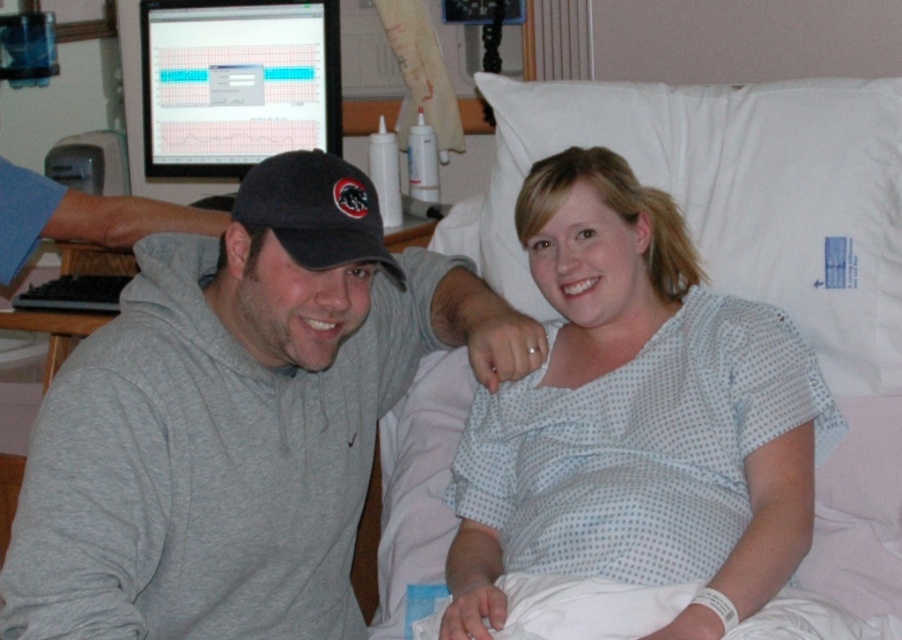
Based on the coordinates provided, which object is located at point (238, 419) in the image?

The gray hoodie at center is located at point (238, 419).

You are a nurse entering the hospital room. You need to check the patient wearing the white dotted hospital gown at center. Where should you look relative to the black fabric baseball cap at center?

The white dotted hospital gown at center is located below the black fabric baseball cap at center, so you should look downward from the black fabric baseball cap at center to find the patient wearing the white dotted hospital gown at center.

You are a nurse entering the hospital room and need to locate both the gray hoodie at center and the black fabric baseball cap at center. Which one is positioned to the left side of the other?

The gray hoodie at center is positioned to the left of the black fabric baseball cap at center.